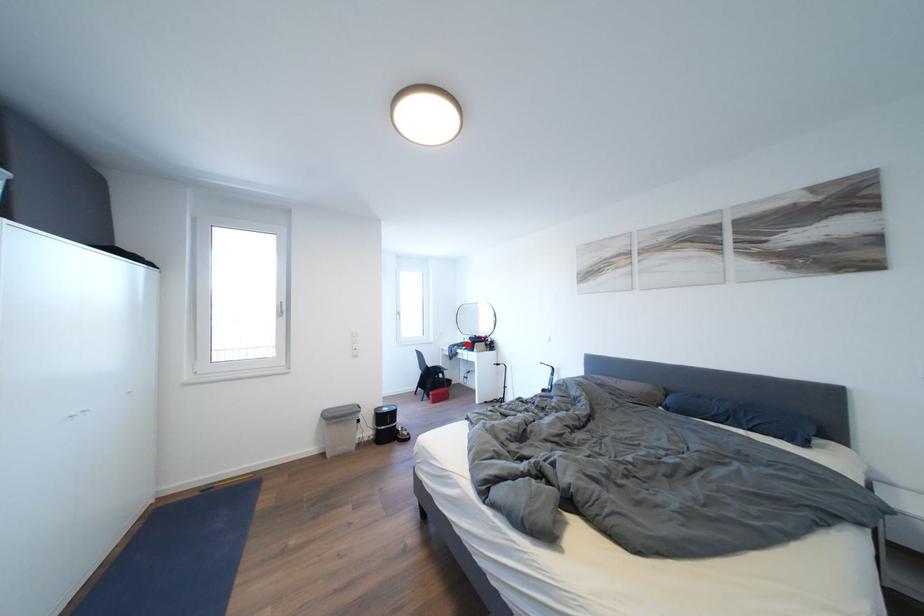
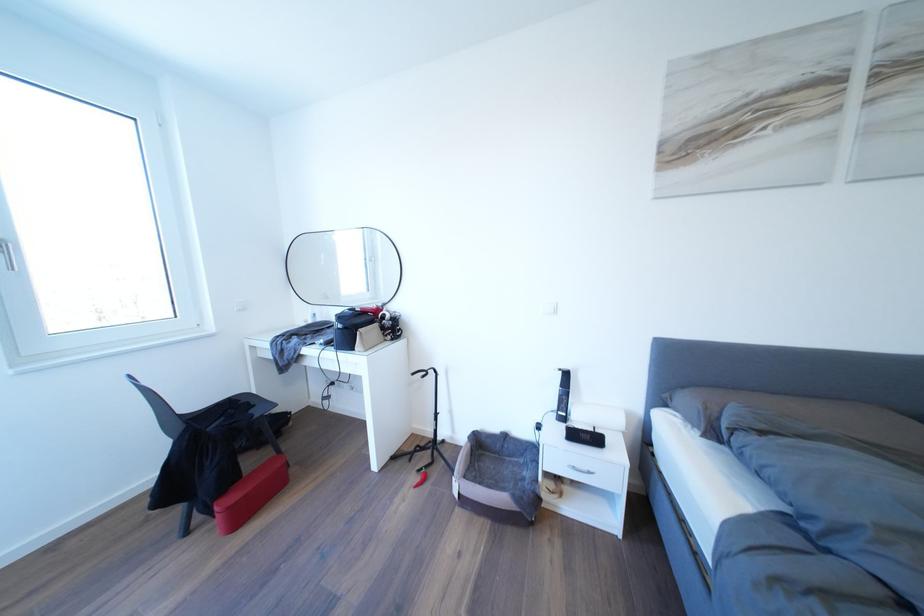
Find the pixel in the second image that matches the highlighted location in the first image.

(310, 322)